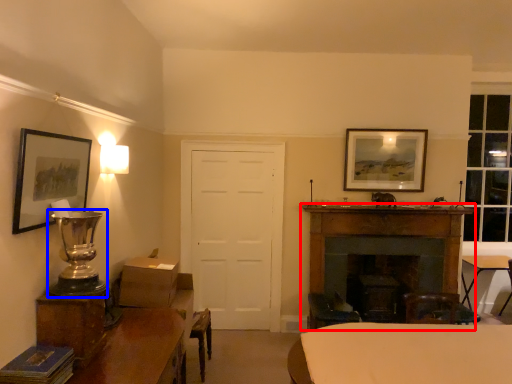
Question: Among these objects, which one is nearest to the camera, fireplace (highlighted by a red box) or table lamp (highlighted by a blue box)?

Choices:
 (A) fireplace
 (B) table lamp

Answer: (B)